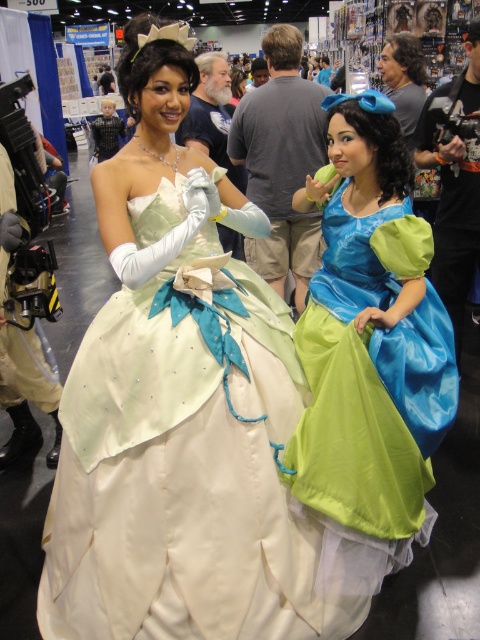
Who is positioned more to the right, satin white dress at center or matte blue-green dress at right?

Positioned to the right is matte blue-green dress at right.

In order to click on satin white dress at center in this screenshot , I will do `click(193, 474)`.